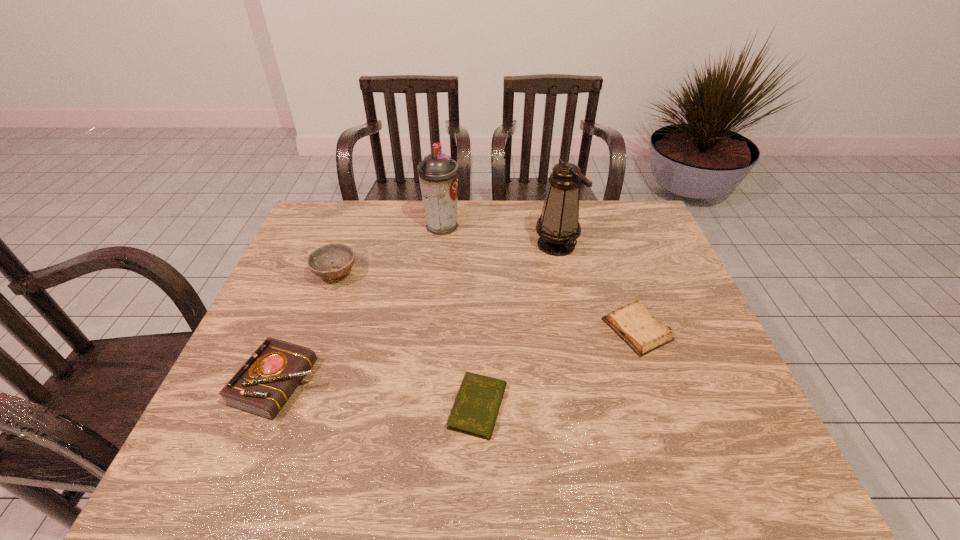
Image resolution: width=960 pixels, height=540 pixels. What are the coordinates of `vacant region between the aerosol can and the second object from right to left` in the screenshot? It's located at (499, 235).

Locate an element on the screen. The height and width of the screenshot is (540, 960). vacant area between the shortest object and the fifth object from left to right is located at coordinates (517, 326).

You are a GUI agent. You are given a task and a screenshot of the screen. Output one action in this format:
    pyautogui.click(x=<x>, y=<y>)
    Task: Click on the free spot between the oil lamp and the shortest diary
    The width and height of the screenshot is (960, 540).
    Given the screenshot: What is the action you would take?
    pyautogui.click(x=517, y=326)

Locate an element on the screen. The width and height of the screenshot is (960, 540). the fifth closest object to the bowl is located at coordinates (633, 323).

Select which object is the closest to the shortest diary. Please provide its 2D coordinates. Your answer should be formatted as a tuple, i.e. [(x, y)], where the tuple contains the x and y coordinates of a point satisfying the conditions above.

[(633, 323)]

Where is `diary that stands as the second closest to the second diary from right to left`? Image resolution: width=960 pixels, height=540 pixels. diary that stands as the second closest to the second diary from right to left is located at coordinates (263, 384).

Select which diary is the closest to the rightmost object. Please provide its 2D coordinates. Your answer should be formatted as a tuple, i.e. [(x, y)], where the tuple contains the x and y coordinates of a point satisfying the conditions above.

[(475, 410)]

You are a GUI agent. You are given a task and a screenshot of the screen. Output one action in this format:
    pyautogui.click(x=<x>, y=<y>)
    Task: Click on the free space in the image that satisfies the following two spatial constraints: 1. on the back side of the second diary from left to right; 2. on the right side of the second object from right to left
    The image size is (960, 540).
    Given the screenshot: What is the action you would take?
    pyautogui.click(x=478, y=245)

Locate an element on the screen. The width and height of the screenshot is (960, 540). free space that satisfies the following two spatial constraints: 1. on the back side of the rightmost object; 2. on the left side of the leftmost diary is located at coordinates (301, 329).

Find the location of a particular element. The height and width of the screenshot is (540, 960). vacant position in the image that satisfies the following two spatial constraints: 1. on the front side of the rightmost diary; 2. on the left side of the bowl is located at coordinates (315, 329).